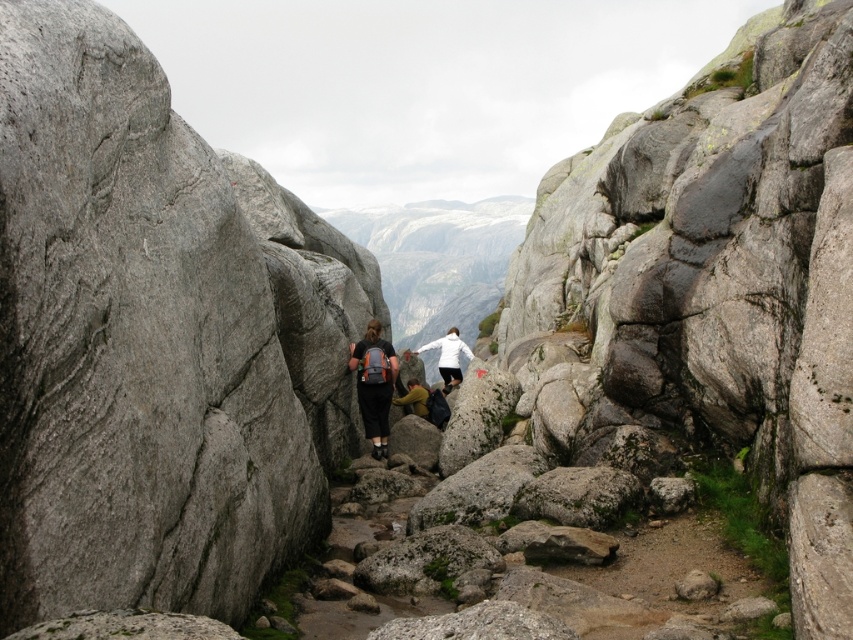
Question: Among these points, which one is nearest to the camera?

Choices:
 (A) (378, 454)
 (B) (440, 284)
 (C) (705, 576)

Answer: (C)

Question: Is gray rock formation at center smaller than yellow fabric jacket at center?

Choices:
 (A) yes
 (B) no

Answer: (B)

Question: Which point appears closest to the camera in this image?

Choices:
 (A) (410, 397)
 (B) (463, 262)

Answer: (A)

Question: Is matte black backpack at center to the left of yellow fabric jacket at center from the viewer's perspective?

Choices:
 (A) yes
 (B) no

Answer: (A)

Question: Does gray rough rock at center appear on the right side of yellow fabric jacket at center?

Choices:
 (A) no
 (B) yes

Answer: (B)

Question: Which point appears farthest from the camera in this image?

Choices:
 (A) (422, 417)
 (B) (444, 349)
 (C) (699, 572)

Answer: (B)